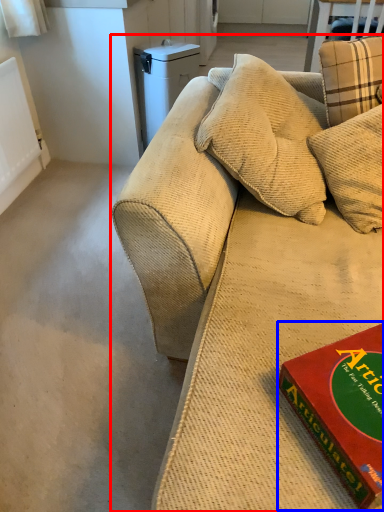
Question: Among these objects, which one is farthest to the camera, studio couch (highlighted by a red box) or paperback book (highlighted by a blue box)?

Choices:
 (A) studio couch
 (B) paperback book

Answer: (A)